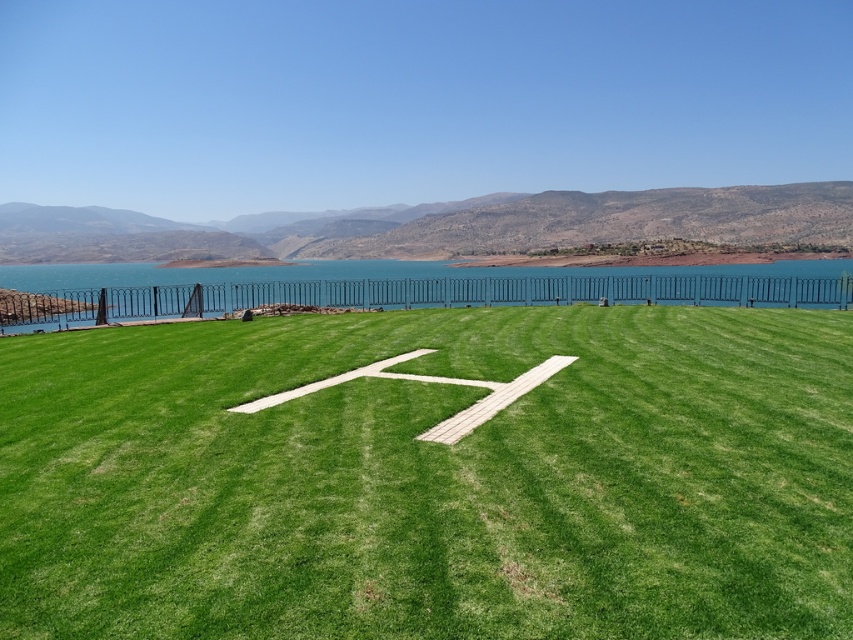
Does green grass at center have a lesser width compared to blue water at upper center?

Correct, green grass at center's width is less than blue water at upper center's.

Is point (334, 490) positioned before point (126, 300)?

Yes.

Find the location of a particular element. The height and width of the screenshot is (640, 853). green grass at center is located at coordinates (432, 477).